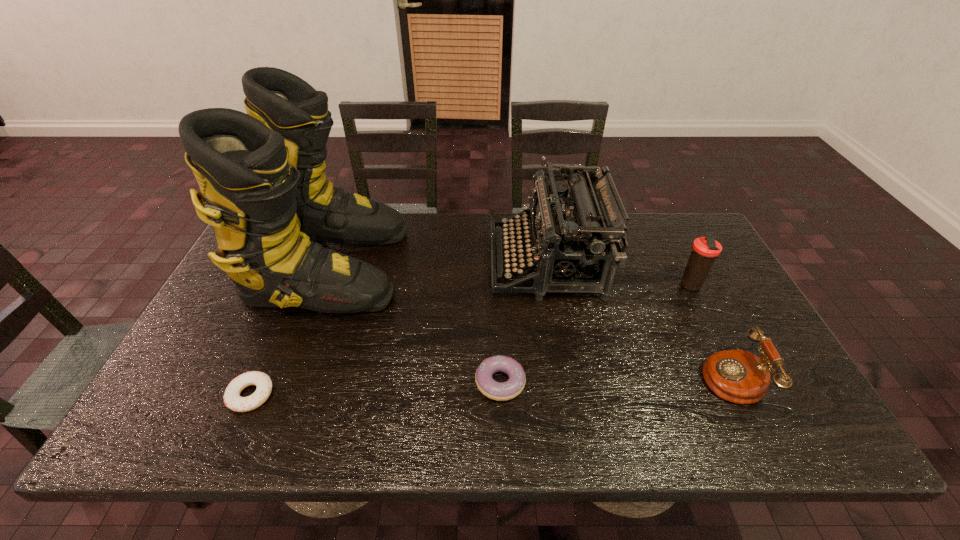
In order to click on empty location between the thermos bottle and the left doughnut in this screenshot , I will do `click(470, 340)`.

In order to click on free space between the second tallest object and the telephone in this screenshot , I will do `click(638, 319)`.

Identify which object is the second closest to the fourth tallest object. Please provide its 2D coordinates. Your answer should be formatted as a tuple, i.e. [(x, y)], where the tuple contains the x and y coordinates of a point satisfying the conditions above.

[(582, 245)]

Identify the location of the second closest object to the thermos bottle. This screenshot has height=540, width=960. (582, 245).

Where is `vacant space that satisfies the following two spatial constraints: 1. on the typing side of the second tallest object; 2. on the front side of the right doughnut`? Image resolution: width=960 pixels, height=540 pixels. vacant space that satisfies the following two spatial constraints: 1. on the typing side of the second tallest object; 2. on the front side of the right doughnut is located at coordinates (566, 382).

Image resolution: width=960 pixels, height=540 pixels. What are the coordinates of `blank space that satisfies the following two spatial constraints: 1. on the typing side of the typewriter; 2. on the back side of the thermos bottle` in the screenshot? It's located at click(x=550, y=286).

Image resolution: width=960 pixels, height=540 pixels. What are the coordinates of `vacant area that satisfies the following two spatial constraints: 1. on the typing side of the second tallest object; 2. on the front side of the fifth tallest object` in the screenshot? It's located at (566, 382).